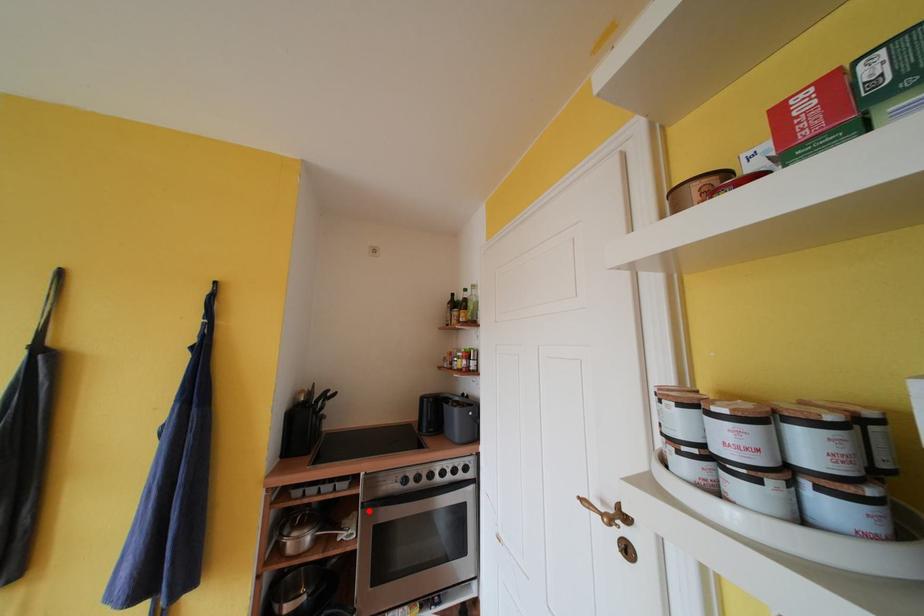
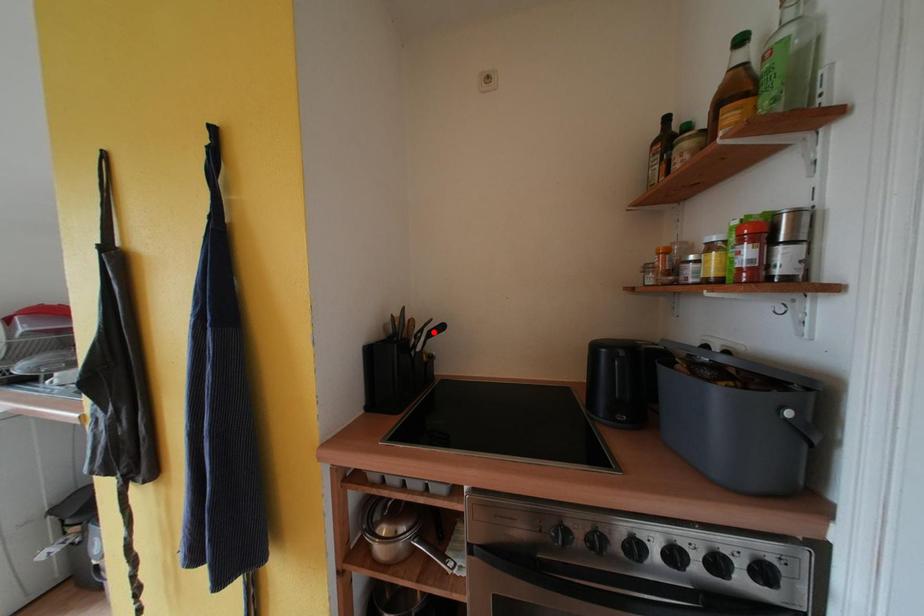
I am providing you with two images of the same scene from different viewpoints. A red point is marked on the first image and another point is marked on the second image. Are the points marked in image1 and image2 representing the same 3D position?

No